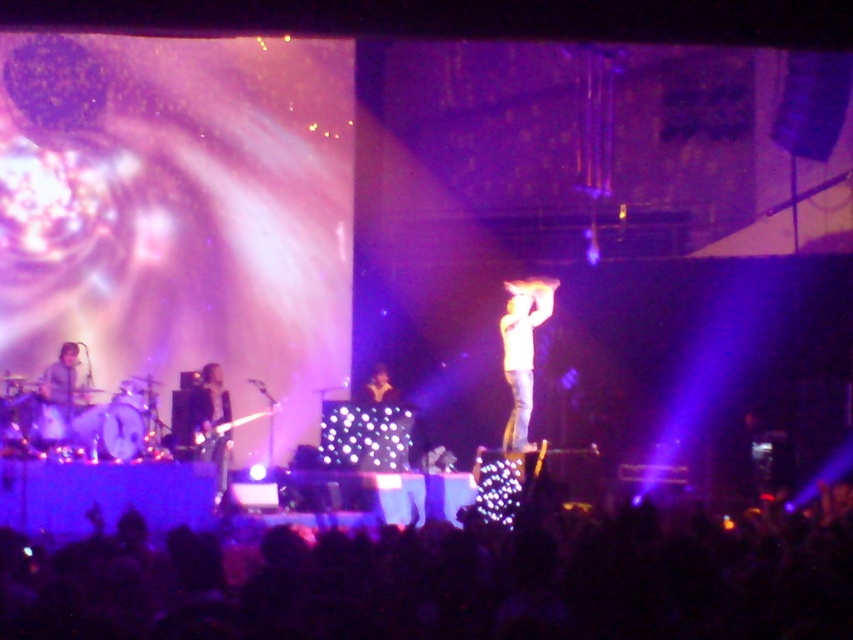
Can you confirm if shiny black guitar at lower left is wider than shiny silver guitar at center?

Yes.

Describe the element at coordinates (209, 422) in the screenshot. I see `shiny black guitar at lower left` at that location.

Between point (207, 422) and point (370, 396), which one is positioned behind?

Point (370, 396)

Identify the location of shiny black guitar at lower left. pyautogui.click(x=209, y=422).

The width and height of the screenshot is (853, 640). What do you see at coordinates (62, 392) in the screenshot?
I see `matte gray shirt at left` at bounding box center [62, 392].

Based on the photo, is the position of matte gray shirt at left more distant than that of shiny silver guitar at center?

No, it is not.

Locate an element on the screen. Image resolution: width=853 pixels, height=640 pixels. matte gray shirt at left is located at coordinates (62, 392).

Is point (653, 577) in front of point (67, 413)?

That is True.

How much distance is there between black fabric crowd at lower center and matte gray shirt at left?

black fabric crowd at lower center and matte gray shirt at left are 6.82 meters apart from each other.

Who is more distant from viewer, (625, 586) or (51, 412)?

Positioned behind is point (51, 412).

In order to click on black fabric crowd at lower center in this screenshot , I will do `click(454, 580)`.